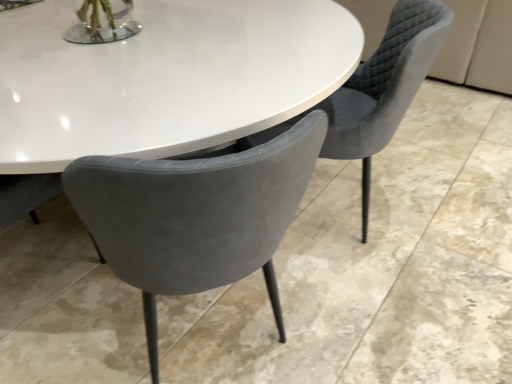
The image size is (512, 384). I want to click on free location in front of velvet grey chair at center, arranged as the 2th chair when viewed from the left, so click(381, 300).